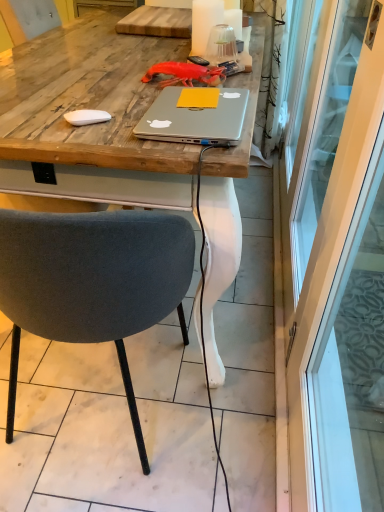
Question: Can you confirm if wooden desk at center is shorter than transparent glass screen door at right?

Choices:
 (A) no
 (B) yes

Answer: (B)

Question: Is wooden desk at center smaller than transparent glass screen door at right?

Choices:
 (A) yes
 (B) no

Answer: (A)

Question: From the image's perspective, is wooden desk at center under transparent glass screen door at right?

Choices:
 (A) yes
 (B) no

Answer: (B)

Question: Is wooden desk at center further to the viewer compared to transparent glass screen door at right?

Choices:
 (A) yes
 (B) no

Answer: (A)

Question: Is wooden desk at center positioned before transparent glass screen door at right?

Choices:
 (A) no
 (B) yes

Answer: (A)

Question: Is wooden desk at center wider than transparent glass screen door at right?

Choices:
 (A) yes
 (B) no

Answer: (A)

Question: Is silver metallic laptop at center positioned in front of velvet grey chair at center?

Choices:
 (A) yes
 (B) no

Answer: (B)

Question: From a real-world perspective, is silver metallic laptop at center located beneath velvet grey chair at center?

Choices:
 (A) no
 (B) yes

Answer: (A)

Question: Can you see silver metallic laptop at center touching velvet grey chair at center?

Choices:
 (A) yes
 (B) no

Answer: (B)

Question: Is silver metallic laptop at center to the right of velvet grey chair at center from the viewer's perspective?

Choices:
 (A) yes
 (B) no

Answer: (A)

Question: Does silver metallic laptop at center turn towards velvet grey chair at center?

Choices:
 (A) yes
 (B) no

Answer: (A)

Question: Is velvet grey chair at center at the back of silver metallic laptop at center?

Choices:
 (A) yes
 (B) no

Answer: (A)

Question: Can you confirm if silver metallic laptop at center is shorter than transparent glass screen door at right?

Choices:
 (A) yes
 (B) no

Answer: (A)